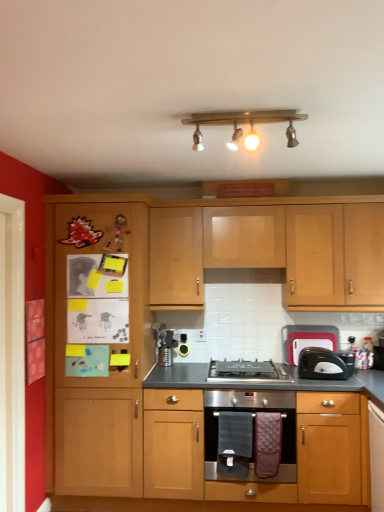
Locate an element on the screen. The height and width of the screenshot is (512, 384). free space above black plastic toaster at right (from a real-world perspective) is located at coordinates (319, 320).